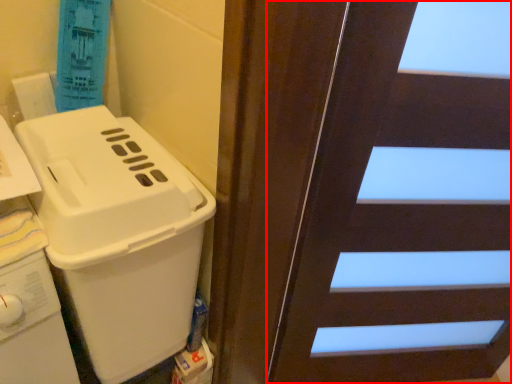
Question: From the image's perspective, what is the correct spatial positioning of door (annotated by the red box) in reference to appliance?

Choices:
 (A) below
 (B) above

Answer: (A)